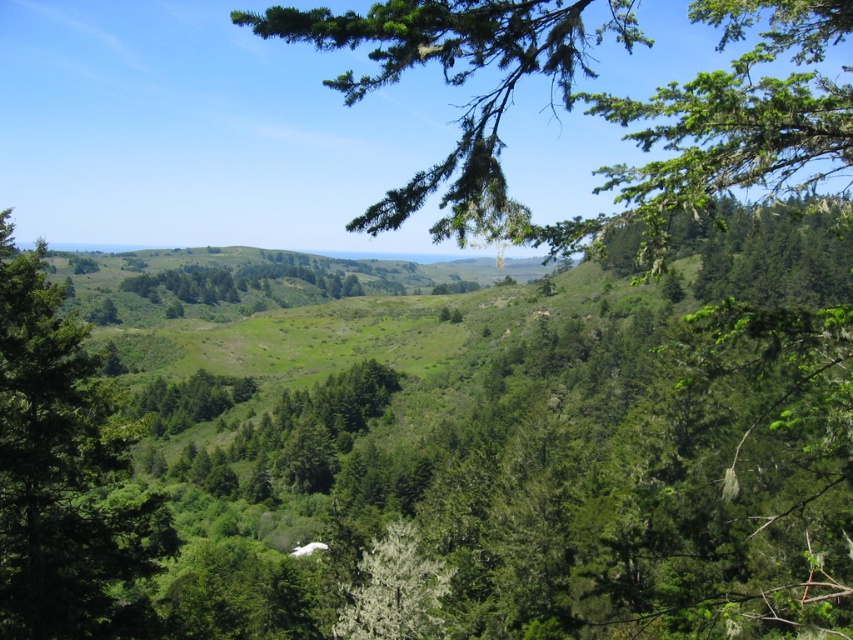
Between point (438, 3) and point (19, 515), which one is positioned in front?

Positioned in front is point (438, 3).

Is green leafy branch at upper center above green leafy tree at center?

Correct, green leafy branch at upper center is located above green leafy tree at center.

Which is behind, point (294, 17) or point (128, 420)?

The point (128, 420) is behind.

Where is `green leafy branch at upper center`? green leafy branch at upper center is located at coordinates (593, 100).

Can you confirm if green leafy branch at upper center is shorter than white fluffy tree at center?

No.

Is green leafy branch at upper center thinner than white fluffy tree at center?

No, green leafy branch at upper center is not thinner than white fluffy tree at center.

Describe the element at coordinates (593, 100) in the screenshot. I see `green leafy branch at upper center` at that location.

This screenshot has width=853, height=640. I want to click on green leafy branch at upper center, so [x=593, y=100].

Between green leafy tree at center and white fluffy tree at center, which one is positioned higher?

green leafy tree at center

Can you confirm if green leafy tree at center is positioned to the left of white fluffy tree at center?

Correct, you'll find green leafy tree at center to the left of white fluffy tree at center.

Who is more forward, (x=76, y=337) or (x=339, y=632)?

Point (x=76, y=337)

Where is `green leafy tree at center`? green leafy tree at center is located at coordinates (65, 474).